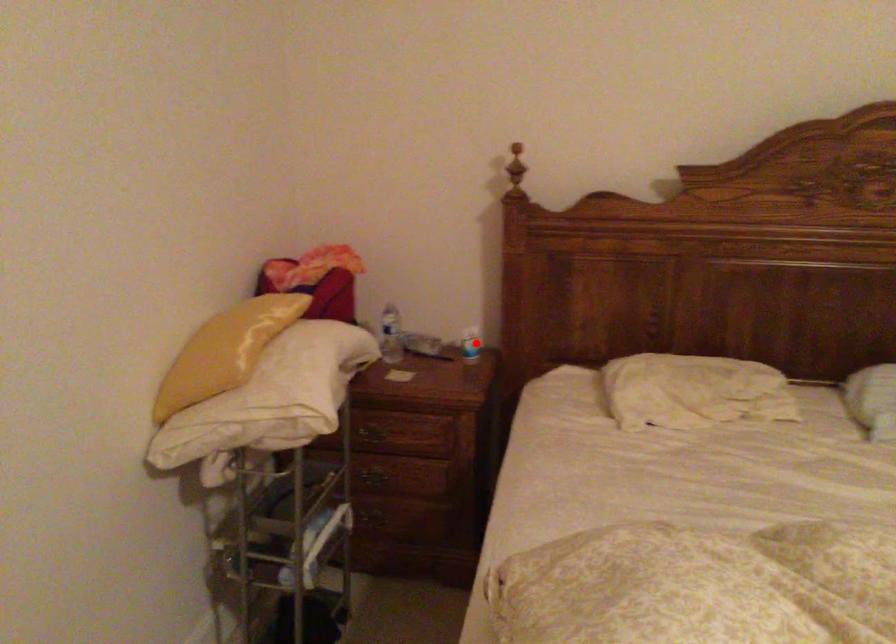
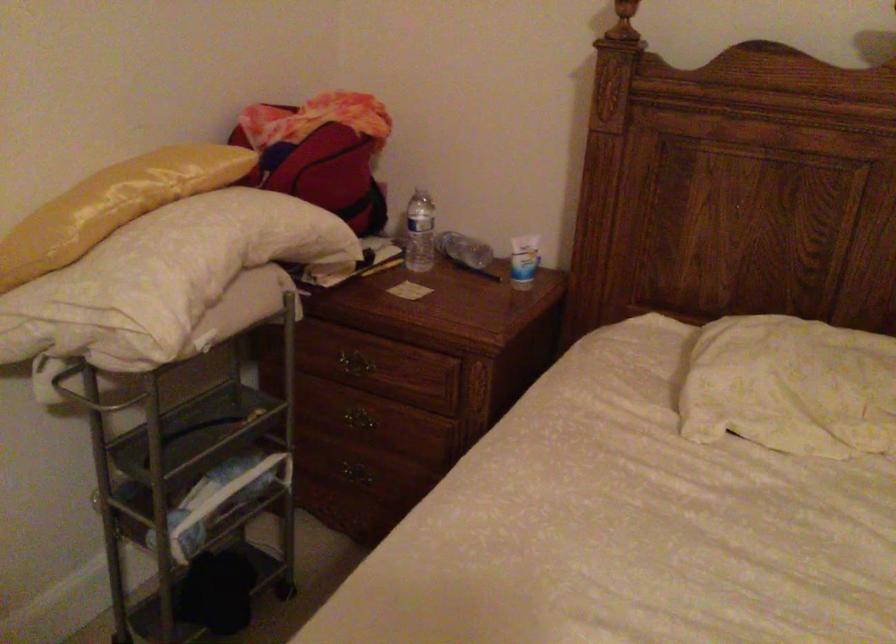
Question: I am providing you with two images of the same scene from different viewpoints. Image1 has a red point marked. In image2, the corresponding 3D location appears at what relative position? Reply with the corresponding letter.

Choices:
 (A) Closer
 (B) Farther

Answer: (A)